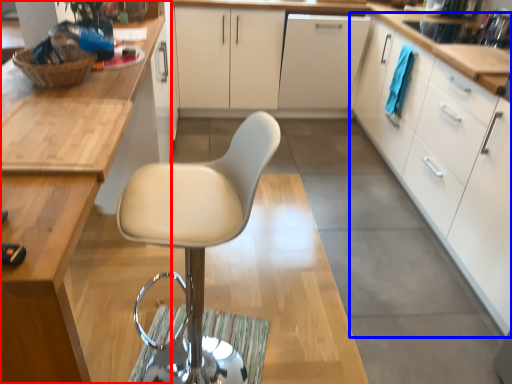
Question: Among these objects, which one is farthest to the camera, cabinetry (highlighted by a red box) or cabinetry (highlighted by a blue box)?

Choices:
 (A) cabinetry
 (B) cabinetry

Answer: (B)